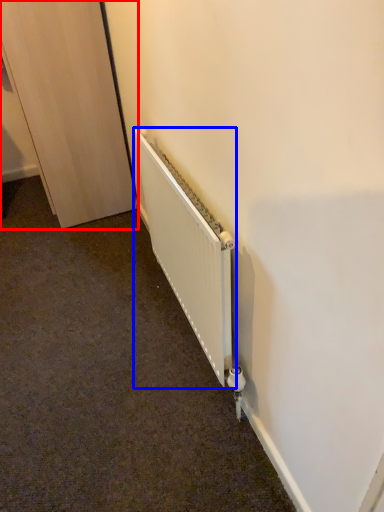
Question: Which object appears closest to the camera in this image, door (highlighted by a red box) or radiator (highlighted by a blue box)?

Choices:
 (A) door
 (B) radiator

Answer: (B)